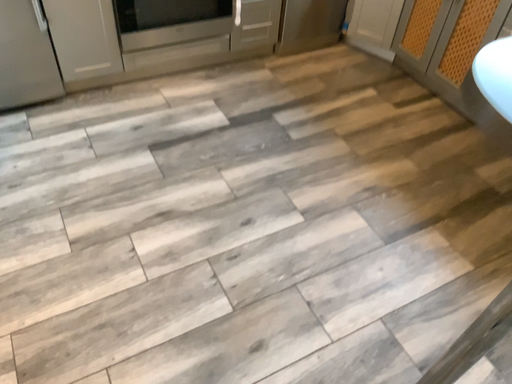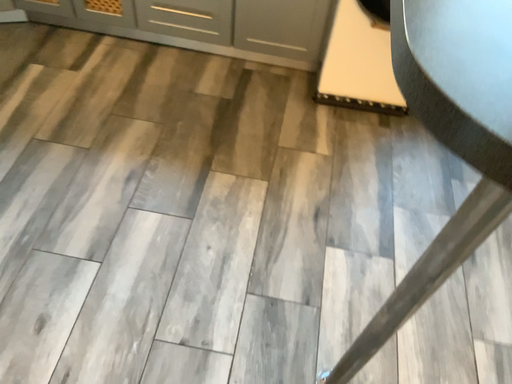
Question: How did the camera likely rotate when shooting the video?

Choices:
 (A) rotated right
 (B) rotated left

Answer: (A)